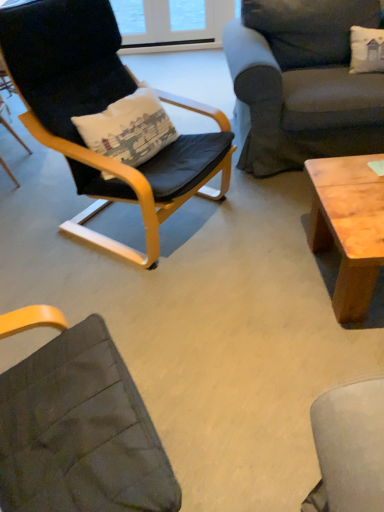
This screenshot has width=384, height=512. Find the location of `vacant area that lies between natural wood coffee table at right and black leather chair at left, the first chair when ordered from right to left`. vacant area that lies between natural wood coffee table at right and black leather chair at left, the first chair when ordered from right to left is located at coordinates (252, 257).